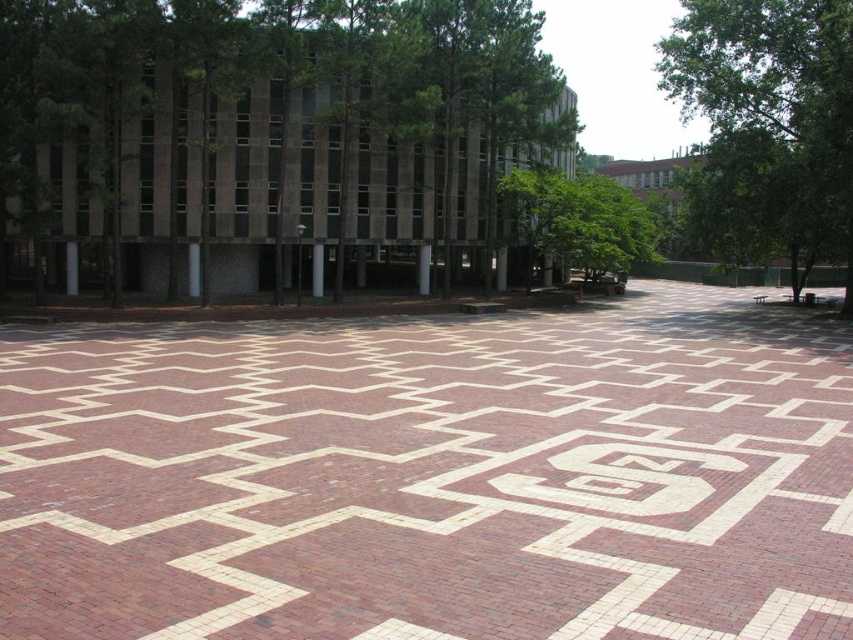
Question: Where is brick at center located in relation to green leafy tree at upper right in the image?

Choices:
 (A) left
 (B) right

Answer: (A)

Question: Among these points, which one is farthest from the camera?

Choices:
 (A) [589, 211]
 (B) [656, 624]

Answer: (A)

Question: Which point is closer to the camera?

Choices:
 (A) click(x=209, y=141)
 (B) click(x=761, y=172)

Answer: (B)

Question: Is brick at center wider than green leafy tree at upper right?

Choices:
 (A) yes
 (B) no

Answer: (B)

Question: Is the position of green leafy tree at upper center less distant than that of green leafy tree at upper right?

Choices:
 (A) no
 (B) yes

Answer: (B)

Question: Among these objects, which one is nearest to the camera?

Choices:
 (A) brick at center
 (B) green leafy tree at center
 (C) green leafy tree at upper right

Answer: (A)